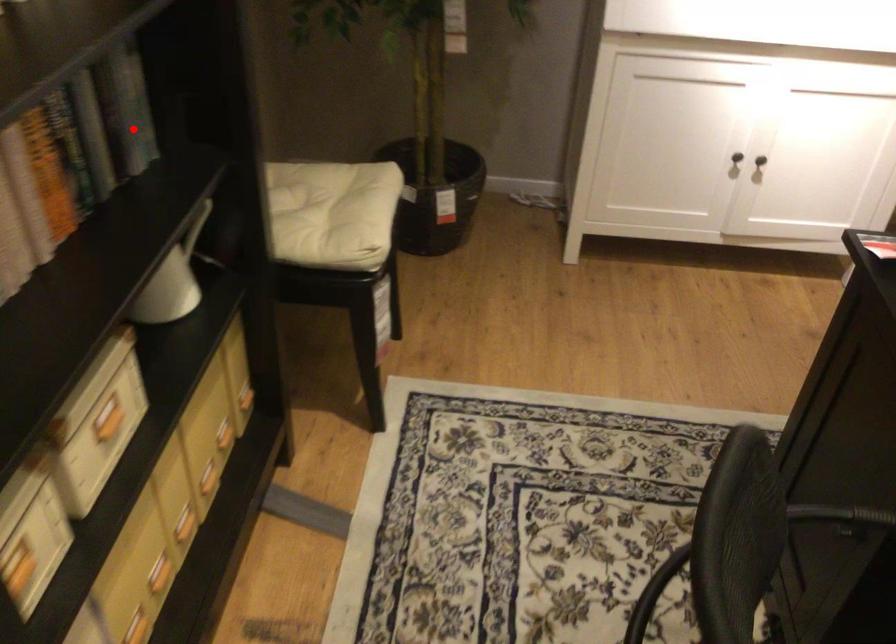
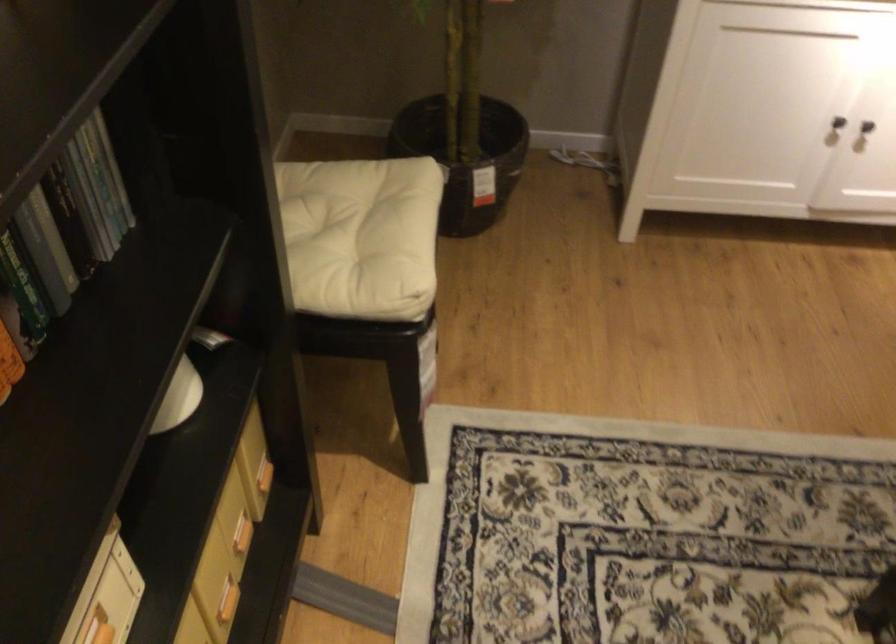
Question: I am providing you with two images of the same scene from different viewpoints. Image1 has a red point marked. In image2, the corresponding 3D location appears at what relative position? Reply with the corresponding letter.

Choices:
 (A) Closer
 (B) Farther

Answer: (A)